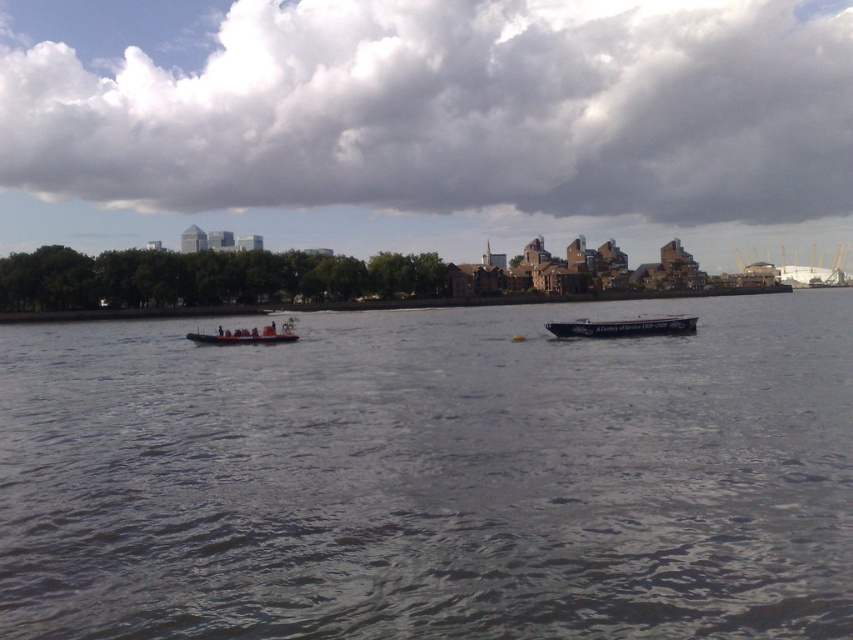
You are standing on the riverbank and see the blue painted wooden boat at center and the orange rubber boat at center. Which boat is closer to the water surface?

The blue painted wooden boat at center is positioned under the orange rubber boat at center, so it is closer to the water surface.

You are standing on the riverbank and see the dark gray water at center and the orange rubber boat at center. Which object is higher in elevation?

The dark gray water at center is much taller than the orange rubber boat at center, so the dark gray water at center is higher in elevation.